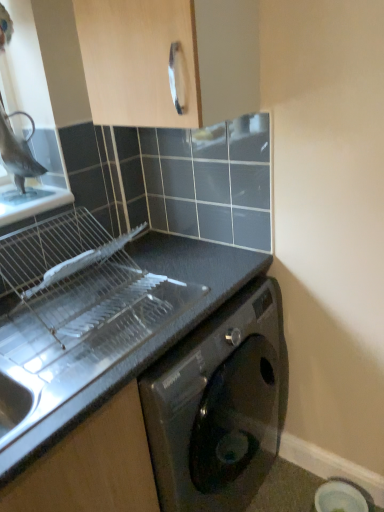
Question: Considering the relative sizes of light wood cabinet handle at upper center and matte black washing machine at lower right in the image provided, is light wood cabinet handle at upper center bigger than matte black washing machine at lower right?

Choices:
 (A) yes
 (B) no

Answer: (A)

Question: Does light wood cabinet handle at upper center come in front of matte black washing machine at lower right?

Choices:
 (A) no
 (B) yes

Answer: (B)

Question: Is light wood cabinet handle at upper center with matte black washing machine at lower right?

Choices:
 (A) yes
 (B) no

Answer: (B)

Question: Is light wood cabinet handle at upper center looking in the opposite direction of matte black washing machine at lower right?

Choices:
 (A) no
 (B) yes

Answer: (A)

Question: Is light wood cabinet handle at upper center facing towards matte black washing machine at lower right?

Choices:
 (A) no
 (B) yes

Answer: (A)

Question: From the image's perspective, is light wood cabinet handle at upper center under matte black washing machine at lower right?

Choices:
 (A) no
 (B) yes

Answer: (A)

Question: Can you confirm if matte black washing machine at lower right is wider than light wood cabinet handle at upper center?

Choices:
 (A) no
 (B) yes

Answer: (A)

Question: Considering the relative positions of matte black washing machine at lower right and light wood cabinet handle at upper center in the image provided, is matte black washing machine at lower right behind light wood cabinet handle at upper center?

Choices:
 (A) no
 (B) yes

Answer: (B)

Question: From the image's perspective, is matte black washing machine at lower right on top of light wood cabinet handle at upper center?

Choices:
 (A) yes
 (B) no

Answer: (B)

Question: Can you confirm if matte black washing machine at lower right is thinner than light wood cabinet handle at upper center?

Choices:
 (A) yes
 (B) no

Answer: (A)

Question: Is matte black washing machine at lower right facing away from light wood cabinet handle at upper center?

Choices:
 (A) yes
 (B) no

Answer: (B)

Question: Does matte black washing machine at lower right appear on the left side of light wood cabinet handle at upper center?

Choices:
 (A) yes
 (B) no

Answer: (B)

Question: From a real-world perspective, does black matte countertop at lower left stand above matte black washing machine at lower right?

Choices:
 (A) yes
 (B) no

Answer: (A)